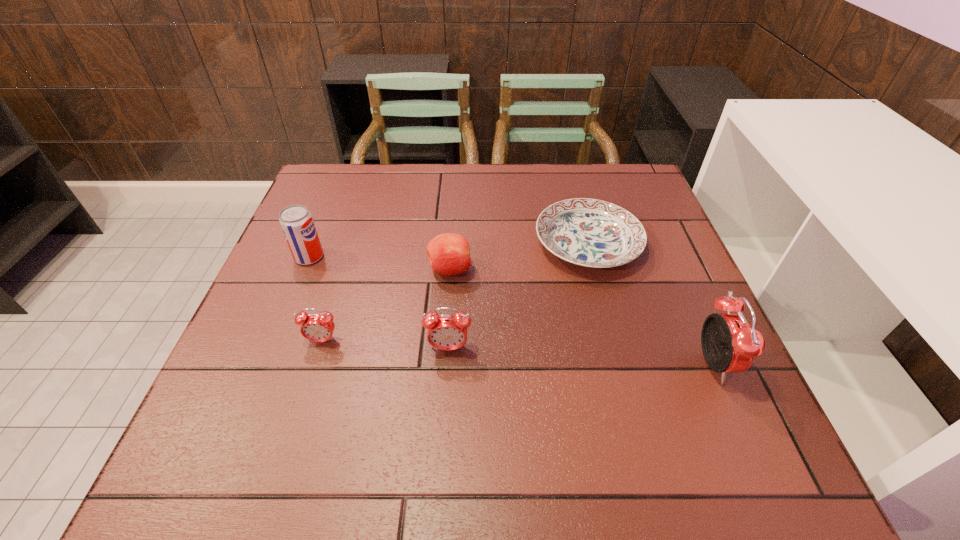
Image resolution: width=960 pixels, height=540 pixels. Find the location of `free spot located 0.120m on the right of the apple`. free spot located 0.120m on the right of the apple is located at coordinates (521, 270).

I want to click on vacant space located on the left of the shortest object, so click(x=507, y=244).

Find the location of `free spot located on the right of the soda`. free spot located on the right of the soda is located at coordinates (396, 257).

Identify the location of object present at the near edge. Image resolution: width=960 pixels, height=540 pixels. (729, 344).

Locate an element on the screen. This screenshot has height=540, width=960. alarm clock present at the left edge is located at coordinates (315, 327).

The width and height of the screenshot is (960, 540). What are the coordinates of `soda located in the left edge section of the desktop` in the screenshot? It's located at (296, 221).

Where is `alarm clock present at the right edge`? The image size is (960, 540). alarm clock present at the right edge is located at coordinates (729, 344).

The height and width of the screenshot is (540, 960). What are the coordinates of `plate that is at the right edge` in the screenshot? It's located at (588, 232).

Where is `object that is at the near right corner`? This screenshot has width=960, height=540. object that is at the near right corner is located at coordinates (729, 344).

Find the location of a particular element. The width and height of the screenshot is (960, 540). blank space at the far edge of the desktop is located at coordinates (561, 178).